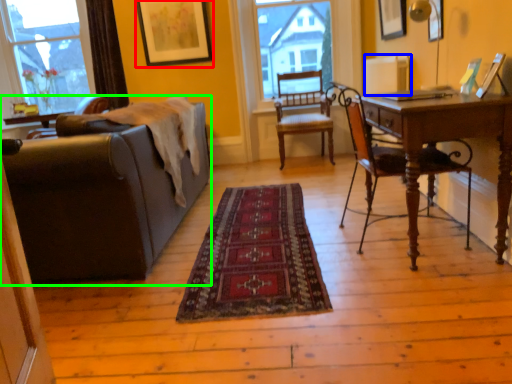
Question: Which object is positioned closest to picture frame (highlighted by a red box)? Select from radiator (highlighted by a blue box) and studio couch (highlighted by a green box).

Choices:
 (A) radiator
 (B) studio couch

Answer: (A)